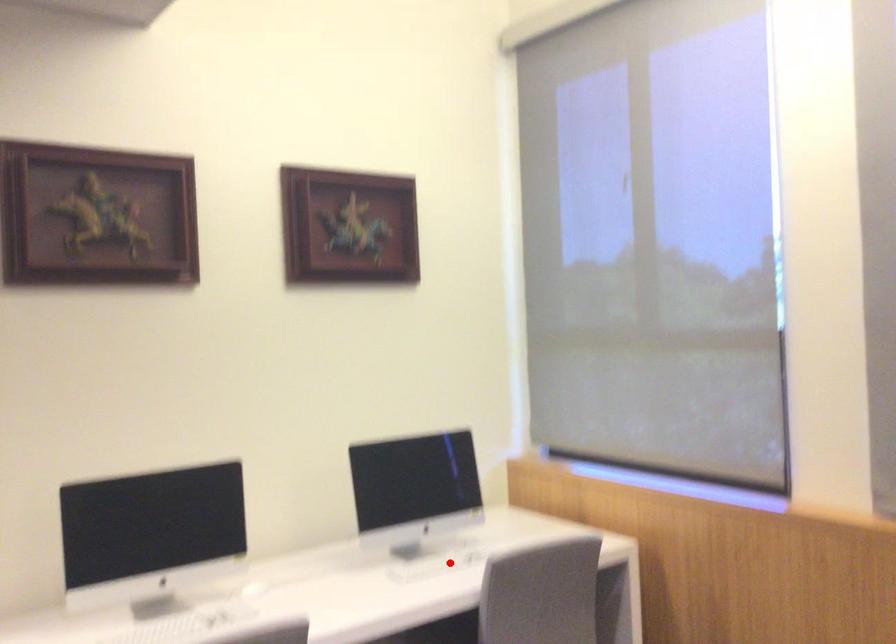
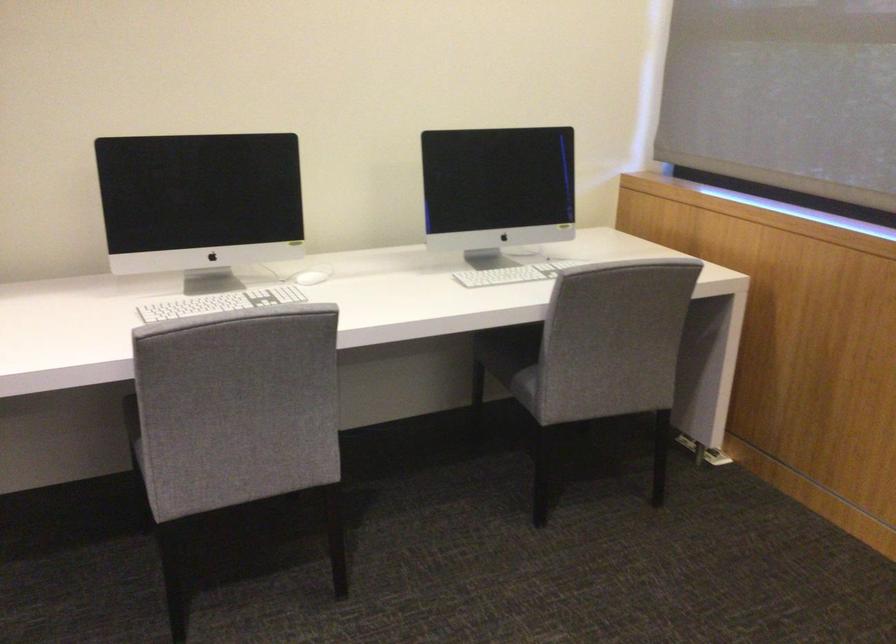
Question: I am providing you with two images of the same scene from different viewpoints. In image1, a red point is highlighted. Considering the same 3D point in image2, which of the following is correct?

Choices:
 (A) It is closer
 (B) It is farther

Answer: (A)